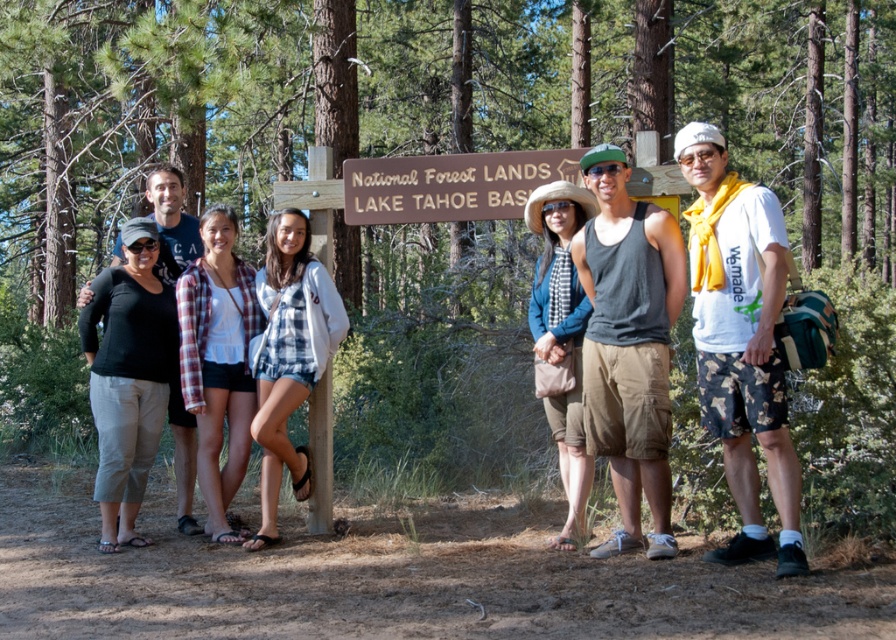
Consider the image. You are standing at the center of the image and want to walk towards the brown dirt trail at lower center. In which direction should you move?

The brown dirt trail at lower center is located at point 0.903 in the x coordinate and 0.438 in the y coordinate. Since you are at the center, you should move towards the lower center direction to reach it.